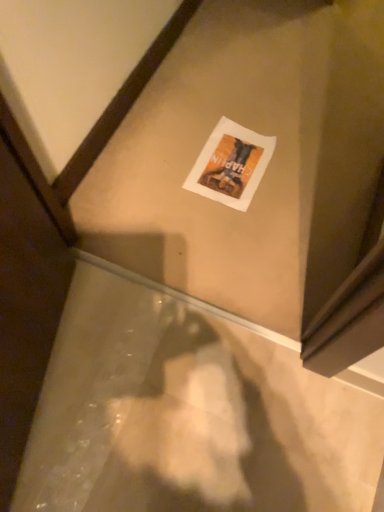
The image size is (384, 512). I want to click on white paper postcard at center, so click(231, 165).

The image size is (384, 512). What do you see at coordinates (231, 165) in the screenshot?
I see `white paper postcard at center` at bounding box center [231, 165].

You are a GUI agent. You are given a task and a screenshot of the screen. Output one action in this format:
    pyautogui.click(x=<x>, y=<y>)
    Task: Click on the white paper postcard at center
    
    Given the screenshot: What is the action you would take?
    pyautogui.click(x=231, y=165)